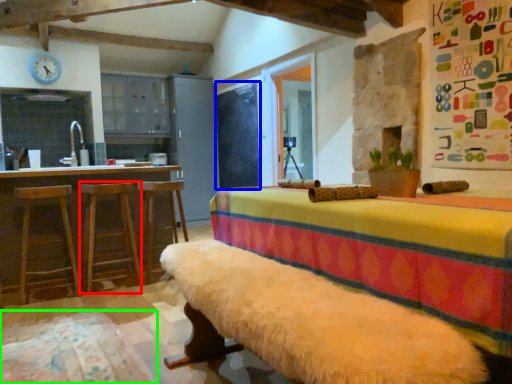
Question: Which is nearer to the bar stool (highlighted by a red box)? bulletin board (highlighted by a blue box) or bedding (highlighted by a green box).

Choices:
 (A) bulletin board
 (B) bedding

Answer: (B)